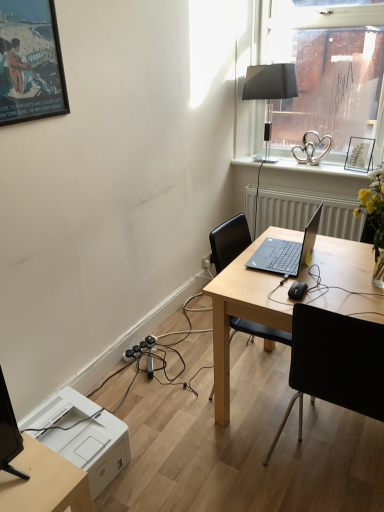
Question: Can you confirm if matte black picture frame at upper right, positioned as the second picture frame in front-to-back order, is thinner than light wood desk at center?

Choices:
 (A) no
 (B) yes

Answer: (B)

Question: From a real-world perspective, is matte black picture frame at upper right, which appears as the first picture frame when viewed from the right, positioned under light wood desk at center based on gravity?

Choices:
 (A) yes
 (B) no

Answer: (B)

Question: Considering the relative positions of matte black picture frame at upper right, the first picture frame viewed from the back, and light wood desk at center in the image provided, is matte black picture frame at upper right, the first picture frame viewed from the back, to the right of light wood desk at center from the viewer's perspective?

Choices:
 (A) yes
 (B) no

Answer: (A)

Question: Is matte black picture frame at upper right, the first picture frame viewed from the back, further to camera compared to light wood desk at center?

Choices:
 (A) yes
 (B) no

Answer: (A)

Question: Is matte black picture frame at upper right, the first picture frame viewed from the back, oriented towards light wood desk at center?

Choices:
 (A) no
 (B) yes

Answer: (B)

Question: From a real-world perspective, is white plastic printer at lower left physically located above or below sleek black laptop at center?

Choices:
 (A) above
 (B) below

Answer: (B)

Question: Is white plastic printer at lower left in front of or behind sleek black laptop at center in the image?

Choices:
 (A) behind
 (B) front

Answer: (B)

Question: Looking at their shapes, would you say white plastic printer at lower left is wider or thinner than sleek black laptop at center?

Choices:
 (A) thin
 (B) wide

Answer: (B)

Question: In the image, is white plastic printer at lower left on the left side or the right side of sleek black laptop at center?

Choices:
 (A) right
 (B) left

Answer: (B)

Question: Visually, is sleek black laptop at center positioned to the left or to the right of white plastic printer at lower left?

Choices:
 (A) right
 (B) left

Answer: (A)

Question: Considering the positions of sleek black laptop at center and white plastic printer at lower left in the image, is sleek black laptop at center wider or thinner than white plastic printer at lower left?

Choices:
 (A) thin
 (B) wide

Answer: (A)

Question: Considering their positions, is sleek black laptop at center located in front of or behind white plastic printer at lower left?

Choices:
 (A) behind
 (B) front

Answer: (A)

Question: From the image's perspective, is sleek black laptop at center located above or below white plastic printer at lower left?

Choices:
 (A) below
 (B) above

Answer: (B)

Question: From the image's perspective, is light wood desk at center positioned above or below matte black picture frame at upper left, which ranks as the first picture frame in front-to-back order?

Choices:
 (A) below
 (B) above

Answer: (A)

Question: Does point (256, 313) appear closer or farther from the camera than point (11, 16)?

Choices:
 (A) closer
 (B) farther

Answer: (B)